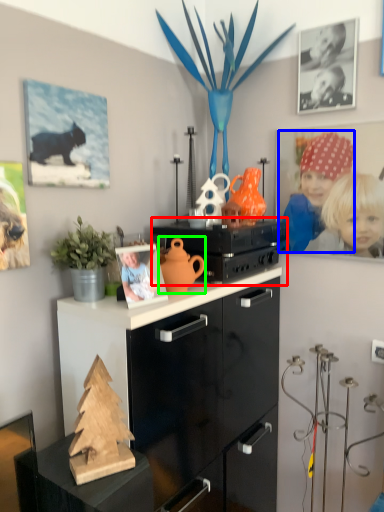
Question: Estimate the real-world distances between objects in this image. Which object is closer to appliance (highlighted by a red box), person (highlighted by a blue box) or toy (highlighted by a green box)?

Choices:
 (A) person
 (B) toy

Answer: (B)